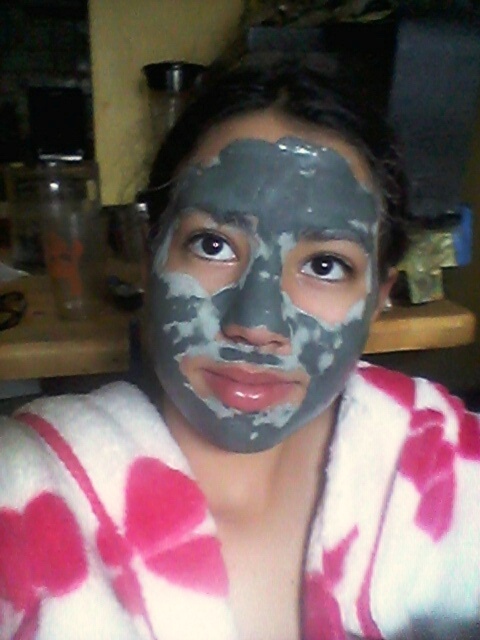
Question: Is white fuzzy bathrobe at center to the right of gray clay mask at center from the viewer's perspective?

Choices:
 (A) no
 (B) yes

Answer: (B)

Question: Which point is closer to the camera?

Choices:
 (A) gray clay mask at center
 (B) white fuzzy bathrobe at center

Answer: (A)

Question: Does white fuzzy bathrobe at center have a larger size compared to gray clay mask at center?

Choices:
 (A) yes
 (B) no

Answer: (A)

Question: Which of the following is the closest to the observer?

Choices:
 (A) (431, 506)
 (B) (362, 216)

Answer: (B)

Question: Can you confirm if white fuzzy bathrobe at center is bigger than gray clay mask at center?

Choices:
 (A) yes
 (B) no

Answer: (A)

Question: Which point appears closest to the camera in this image?

Choices:
 (A) (323, 188)
 (B) (373, 522)

Answer: (A)